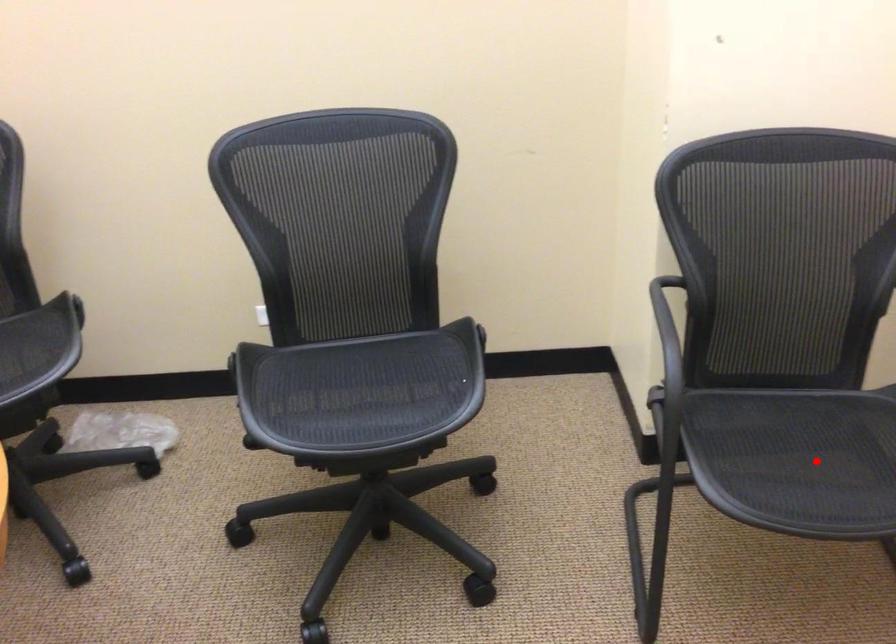
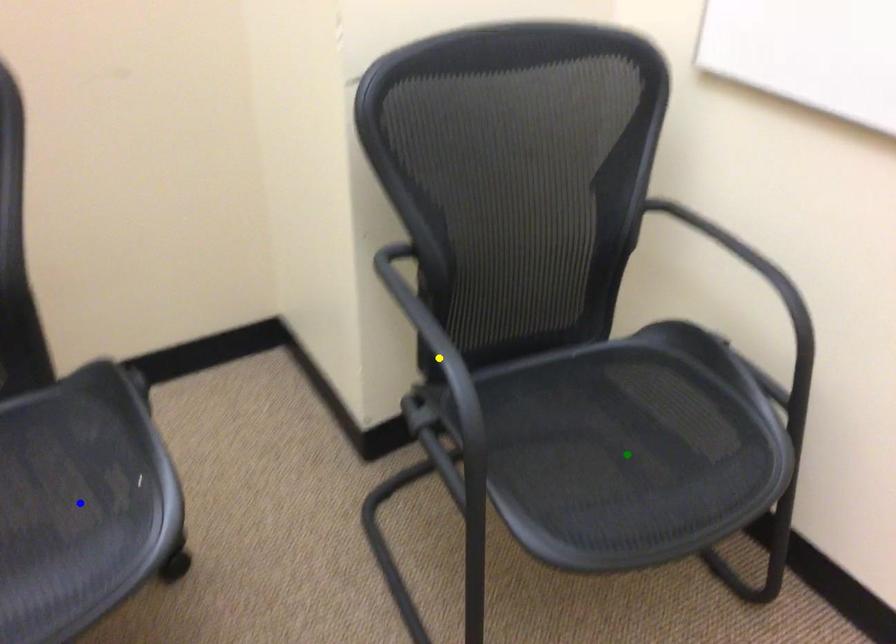
Question: I am providing you with two images of the same scene from different viewpoints. A red point is marked on the first image. You are given multiple points on the second image. Which point in image 2 represents the same 3d spot as the red point in image 1?

Choices:
 (A) yellow point
 (B) green point
 (C) blue point

Answer: (B)